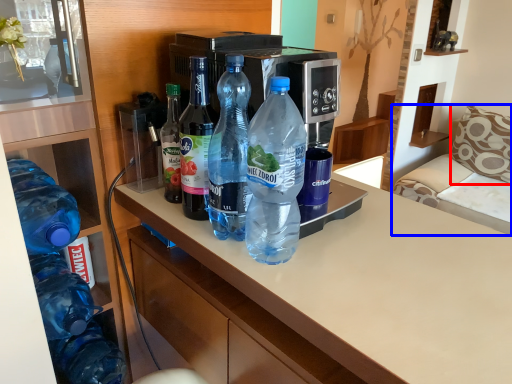
Question: Which object is closer to the camera taking this photo, pillow (highlighted by a red box) or furniture (highlighted by a blue box)?

Choices:
 (A) pillow
 (B) furniture

Answer: (B)